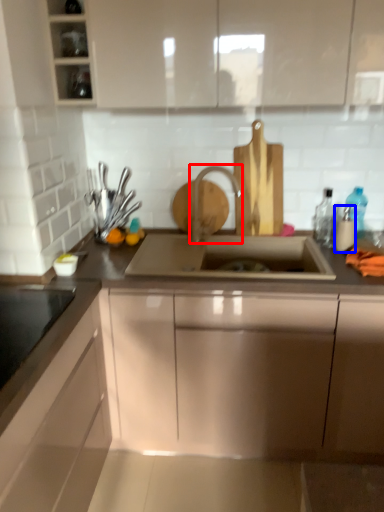
Question: Which point is closer to the camera, tap (highlighted by a red box) or bottle (highlighted by a blue box)?

Choices:
 (A) tap
 (B) bottle

Answer: (B)